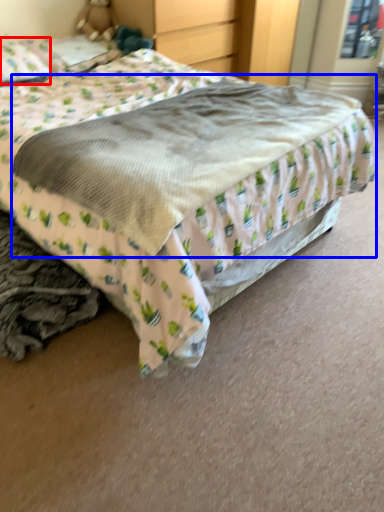
Question: Which point is further to the camera, pillow (highlighted by a red box) or mattress (highlighted by a blue box)?

Choices:
 (A) pillow
 (B) mattress

Answer: (A)